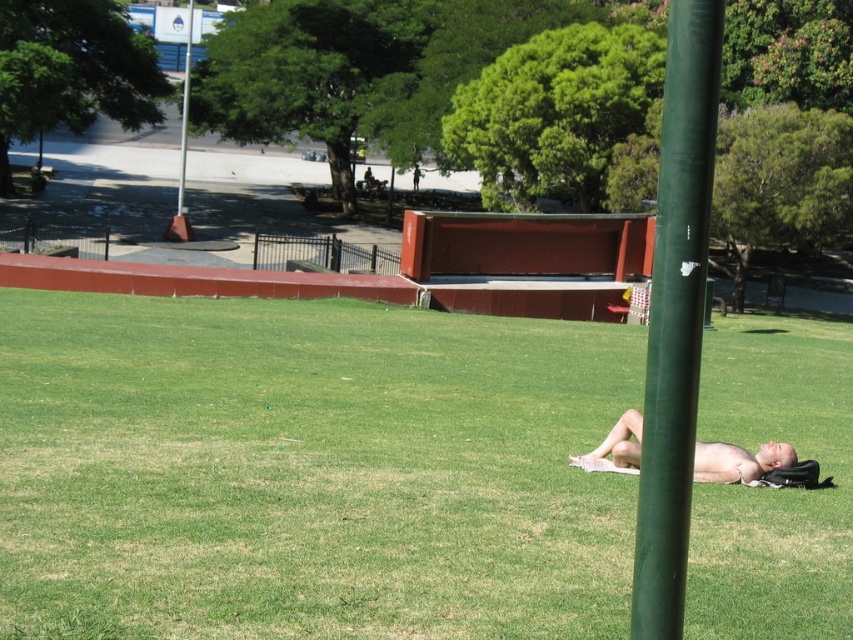
Question: Which point appears closest to the camera in this image?

Choices:
 (A) (782, 449)
 (B) (697, 100)

Answer: (B)

Question: Which object appears closest to the camera in this image?

Choices:
 (A) green matte pole at upper center
 (B) nude skin at lower right

Answer: (B)

Question: Which object appears farthest from the camera in this image?

Choices:
 (A) green matte pole at upper center
 (B) green matte pole at center

Answer: (A)

Question: From the image, what is the correct spatial relationship of green matte pole at center in relation to nude skin at lower right?

Choices:
 (A) left
 (B) right

Answer: (B)

Question: Is nude skin at lower right smaller than green matte pole at upper center?

Choices:
 (A) yes
 (B) no

Answer: (A)

Question: Is nude skin at lower right further to camera compared to green matte pole at upper center?

Choices:
 (A) no
 (B) yes

Answer: (A)